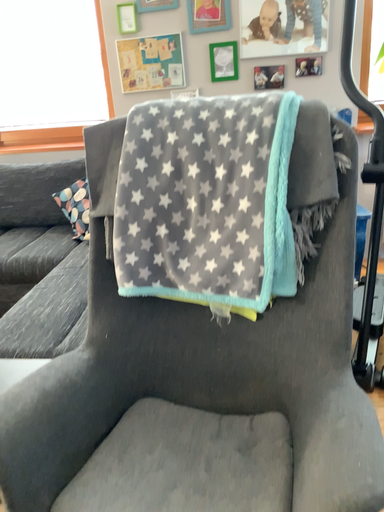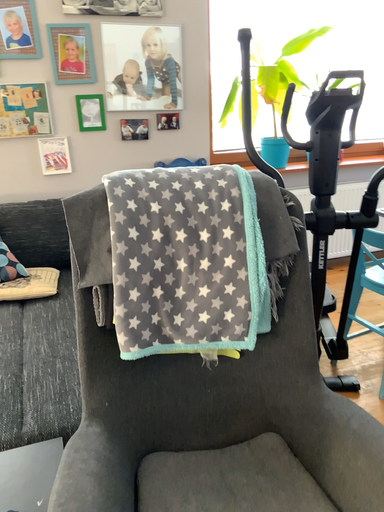
Question: How did the camera likely rotate when shooting the video?

Choices:
 (A) rotated right
 (B) rotated left

Answer: (A)